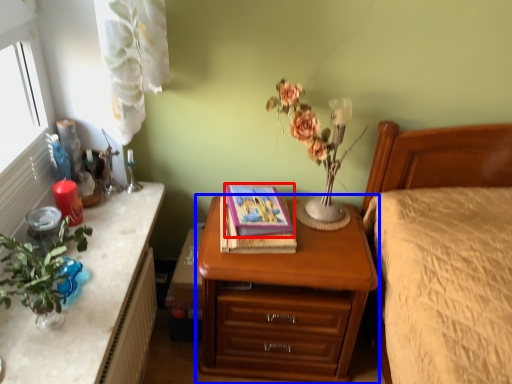
Question: Which point is further to the camera, book (highlighted by a red box) or nightstand (highlighted by a blue box)?

Choices:
 (A) book
 (B) nightstand

Answer: (A)